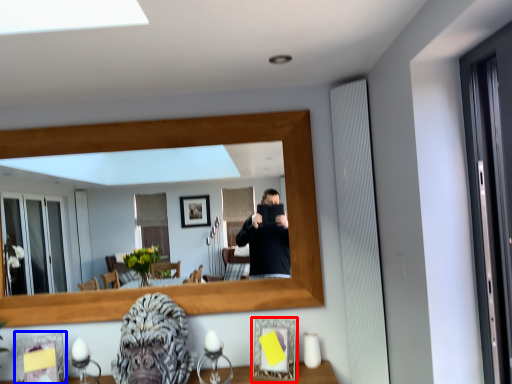
Question: Which object appears farthest to the camera in this image, picture frame (highlighted by a red box) or picture frame (highlighted by a blue box)?

Choices:
 (A) picture frame
 (B) picture frame

Answer: (B)